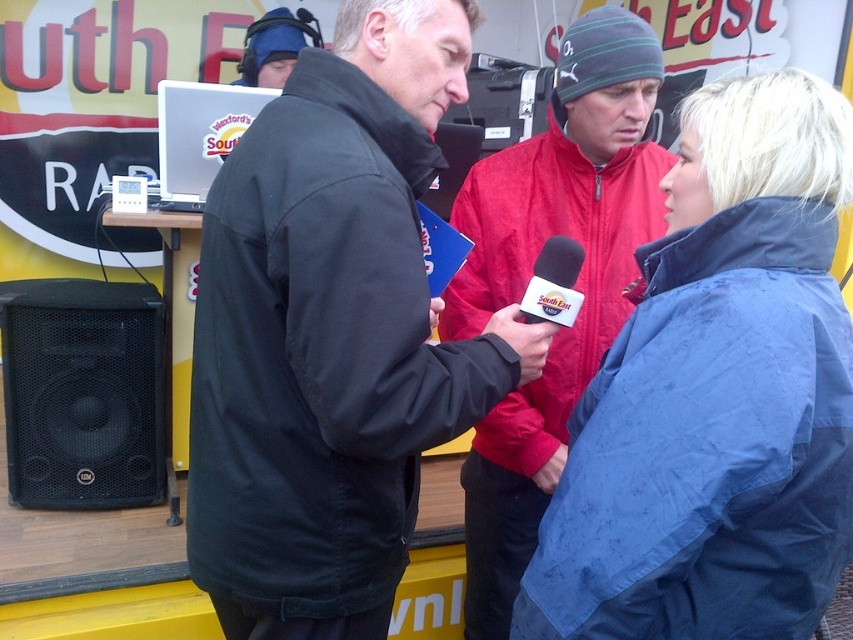
You are standing at the point labeled point (630, 22) and want to move to the point labeled point (550, 332). Which direction should you move to reach your destination?

You should move away from the viewer to reach point (550, 332) because point (630, 22) is closer to the viewer than point (550, 332).

You are a photographer at the event and need to capture a photo of both the red fleece jacket at center and the matte black microphone at center. Based on their positions, which object is closer to the camera?

The red fleece jacket at center is positioned under the matte black microphone at center, meaning it is closer to the camera.